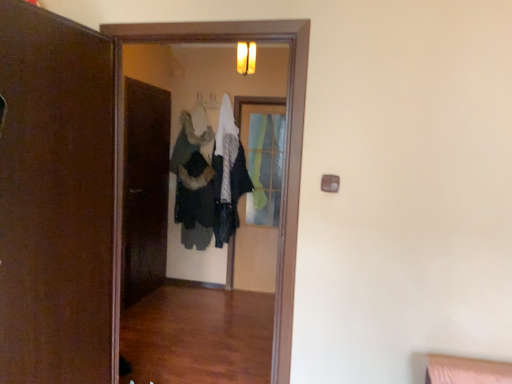
The width and height of the screenshot is (512, 384). I want to click on vacant space situated above wooden screen door at center, the 2th screen door viewed from the back (from a real-world perspective), so click(x=192, y=16).